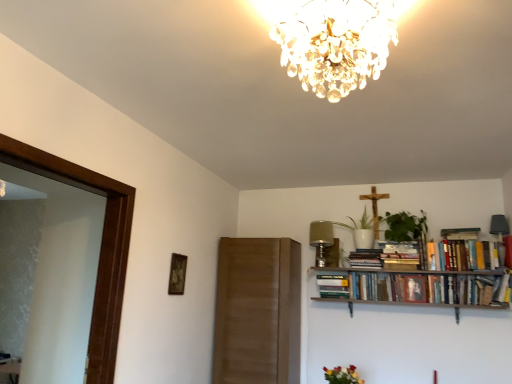
Question: From a real-world perspective, is white ceramic vase at upper center, arranged as the second plant when viewed from the right, over wooden crucifix at upper center?

Choices:
 (A) yes
 (B) no

Answer: (B)

Question: Can you confirm if white ceramic vase at upper center, arranged as the second plant when viewed from the right, is taller than wooden crucifix at upper center?

Choices:
 (A) yes
 (B) no

Answer: (B)

Question: Is there a large distance between white ceramic vase at upper center, the 1th plant from the left, and wooden crucifix at upper center?

Choices:
 (A) yes
 (B) no

Answer: (B)

Question: Considering the relative sizes of white ceramic vase at upper center, arranged as the second plant when viewed from the right, and wooden crucifix at upper center in the image provided, is white ceramic vase at upper center, arranged as the second plant when viewed from the right, thinner than wooden crucifix at upper center?

Choices:
 (A) yes
 (B) no

Answer: (B)

Question: From a real-world perspective, is white ceramic vase at upper center, arranged as the second plant when viewed from the right, located beneath wooden crucifix at upper center?

Choices:
 (A) no
 (B) yes

Answer: (B)

Question: Is white ceramic vase at upper center, the 1th plant from the left, at the right side of wooden crucifix at upper center?

Choices:
 (A) no
 (B) yes

Answer: (A)

Question: Is the depth of hardcover books at upper right, the 1th book viewed from the right, greater than that of hardcover books at upper right, the 2th book in the left-to-right sequence?

Choices:
 (A) no
 (B) yes

Answer: (A)

Question: Is hardcover books at upper right, the 1th book viewed from the right, at the right side of hardcover books at upper right, arranged as the 3th book when viewed from the right?

Choices:
 (A) yes
 (B) no

Answer: (A)

Question: From the image's perspective, is hardcover books at upper right, acting as the fourth book starting from the left, beneath hardcover books at upper right, the 2th book in the left-to-right sequence?

Choices:
 (A) yes
 (B) no

Answer: (B)

Question: Does hardcover books at upper right, acting as the fourth book starting from the left, have a greater width compared to hardcover books at upper right, the 2th book in the left-to-right sequence?

Choices:
 (A) no
 (B) yes

Answer: (B)

Question: From a real-world perspective, is hardcover books at upper right, the 1th book viewed from the right, located higher than hardcover books at upper right, the 2th book in the left-to-right sequence?

Choices:
 (A) no
 (B) yes

Answer: (B)

Question: Does hardcover books at upper right, the 1th book viewed from the right, appear on the left side of hardcover books at upper right, the 2th book in the left-to-right sequence?

Choices:
 (A) no
 (B) yes

Answer: (A)

Question: Is vibrant bouquet at lower center further to camera compared to hardcover books at upper right, arranged as the 3th book when viewed from the right?

Choices:
 (A) no
 (B) yes

Answer: (A)